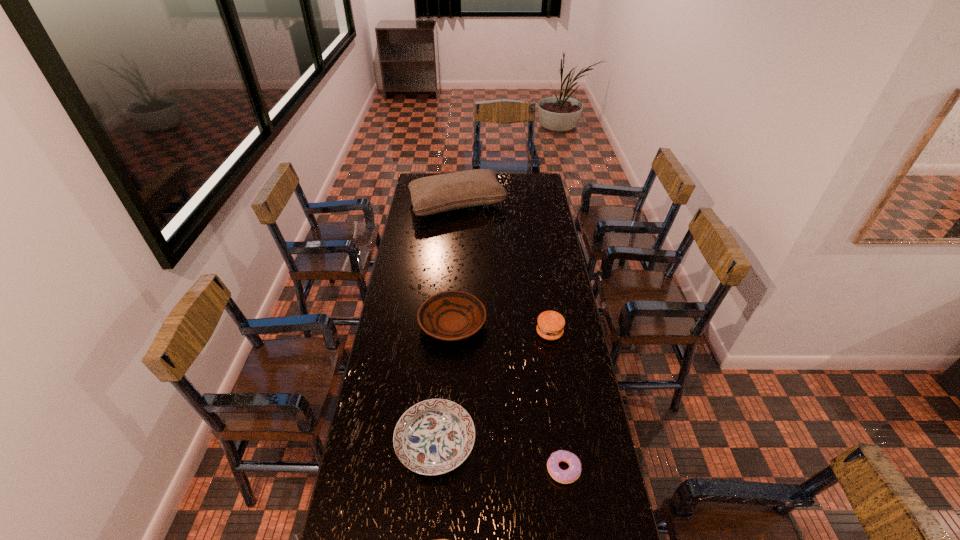
Identify the location of the farthest object. Image resolution: width=960 pixels, height=540 pixels. (430, 195).

The image size is (960, 540). I want to click on cushion, so click(430, 195).

Identify the location of the fifth shortest object. (550, 325).

Identify the location of the farthest plate. (452, 315).

Find the location of a particular element. This screenshot has height=540, width=960. the third tallest object is located at coordinates (452, 315).

At what (x,y) coordinates should I click in order to perform the action: click on the second farthest plate. Please return your answer as a coordinate pair (x, y). Looking at the image, I should click on (433, 437).

I want to click on doughnut, so click(568, 476).

This screenshot has height=540, width=960. What are the coordinates of `vacant space located on the front of the farthest object` in the screenshot? It's located at (453, 267).

Image resolution: width=960 pixels, height=540 pixels. Identify the location of free location located 0.110m on the back of the patty. (545, 303).

Where is `free space located 0.050m on the right of the third tallest object`? This screenshot has width=960, height=540. free space located 0.050m on the right of the third tallest object is located at coordinates (498, 323).